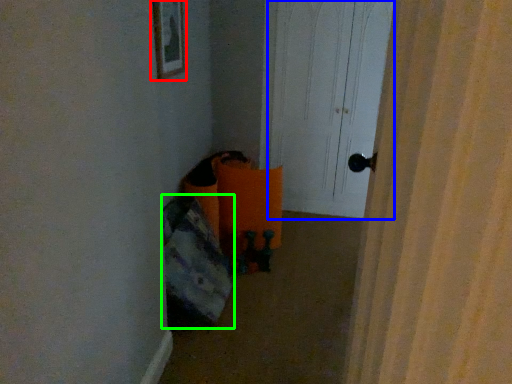
Question: Which object is the farthest from picture frame (highlighted by a red box)? Choose among these: screen door (highlighted by a blue box) or bean bag chair (highlighted by a green box).

Choices:
 (A) screen door
 (B) bean bag chair

Answer: (A)